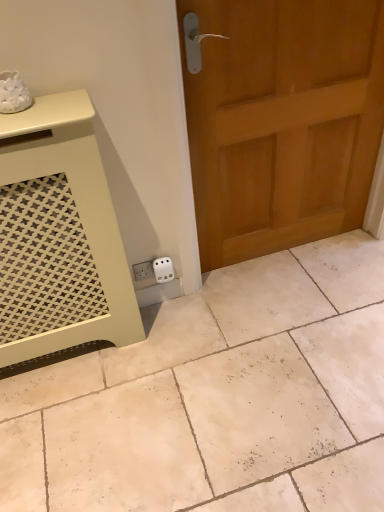
Locate an element on the screen. This screenshot has width=384, height=512. unoccupied region to the right of matte cream vanity at lower left is located at coordinates (195, 356).